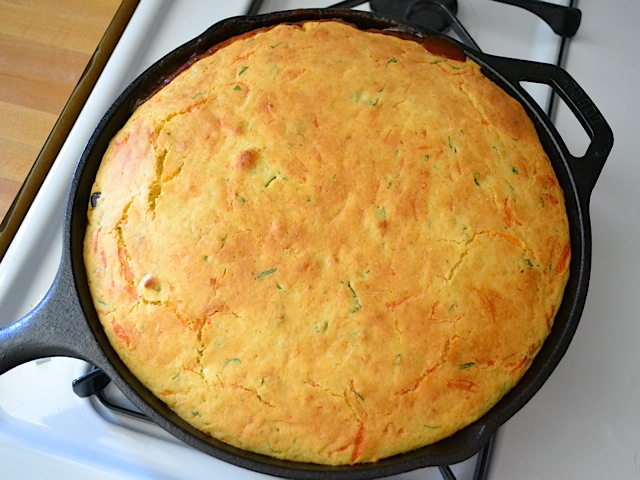
Where is `handle of skillet`? The width and height of the screenshot is (640, 480). handle of skillet is located at coordinates (26, 333).